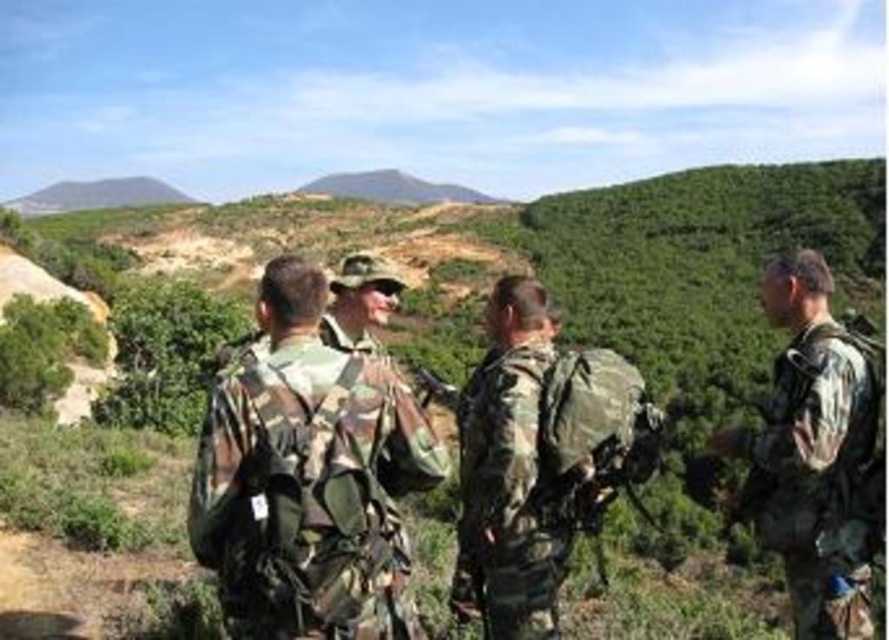
You are a photographer trying to capture a clear photo of the camouflage fabric uniform at center and the camouflage fabric backpack at center. Since both are in the same area, which one is closer to the camera?

The camouflage fabric uniform at center is in front of the camouflage fabric backpack at center, so it is closer to the camera.

You are a photographer trying to capture a clear image of the camouflage fabric uniform at center and the camouflage fabric backpack at center. Since you want the uniform to appear larger in the photo than the backpack, should you move closer to or farther away from the subjects?

The camouflage fabric uniform at center is smaller than the camouflage fabric backpack at center. To make the uniform appear larger relative to the backpack in the photo, you should move closer to the subjects. Moving closer will magnify both objects, but since the uniform is already smaller, this adjustment might not achieve the desired effect. Alternatively, recompose the shot to focus on the uniform while excluding the backpack for a clearer view.